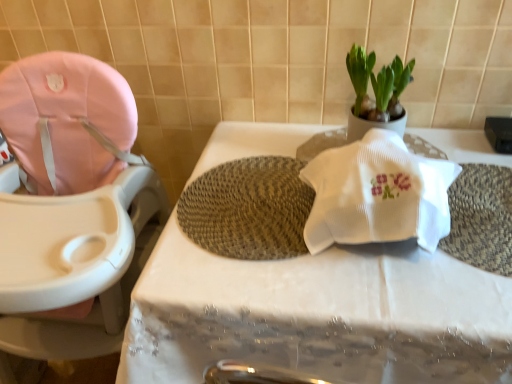
The image size is (512, 384). Find the location of `vacant region to the left of white matte pot at upper right`. vacant region to the left of white matte pot at upper right is located at coordinates (294, 141).